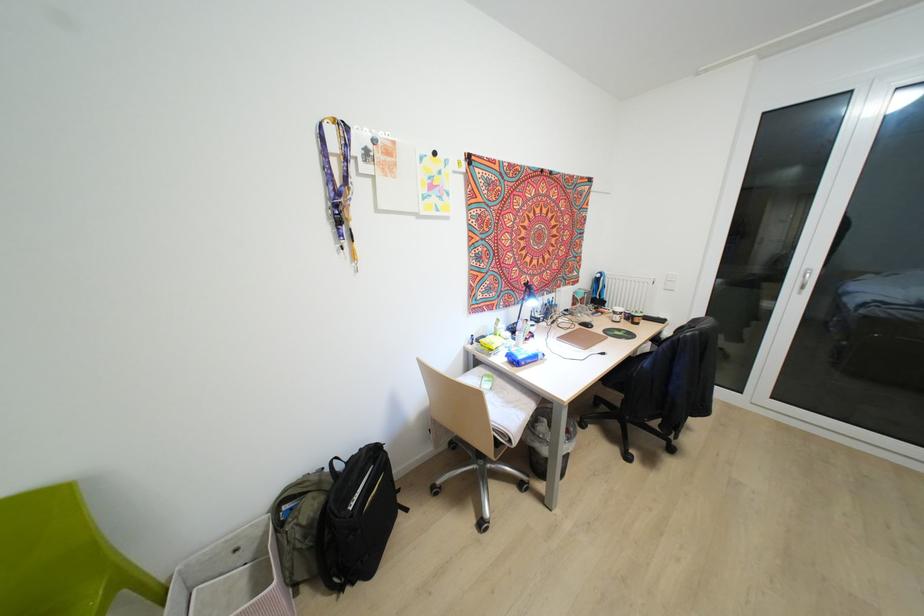
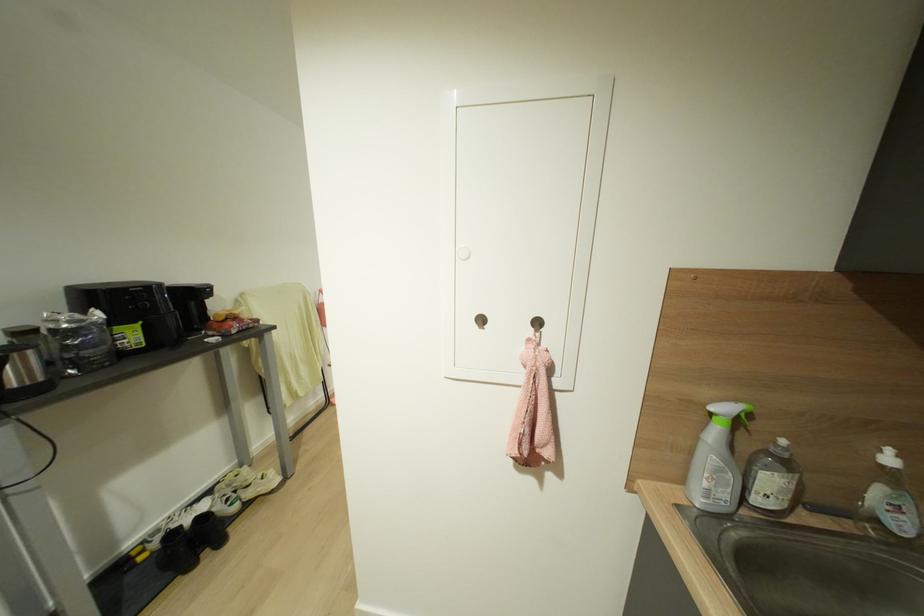
Question: I am providing you with two images of the same scene from different viewpoints. Which of the following objects are not visible in image2?

Choices:
 (A) white sneaker
 (B) black chair sitting surface
 (C) black electric toothbrush
 (D) metal wall hook

Answer: (B)